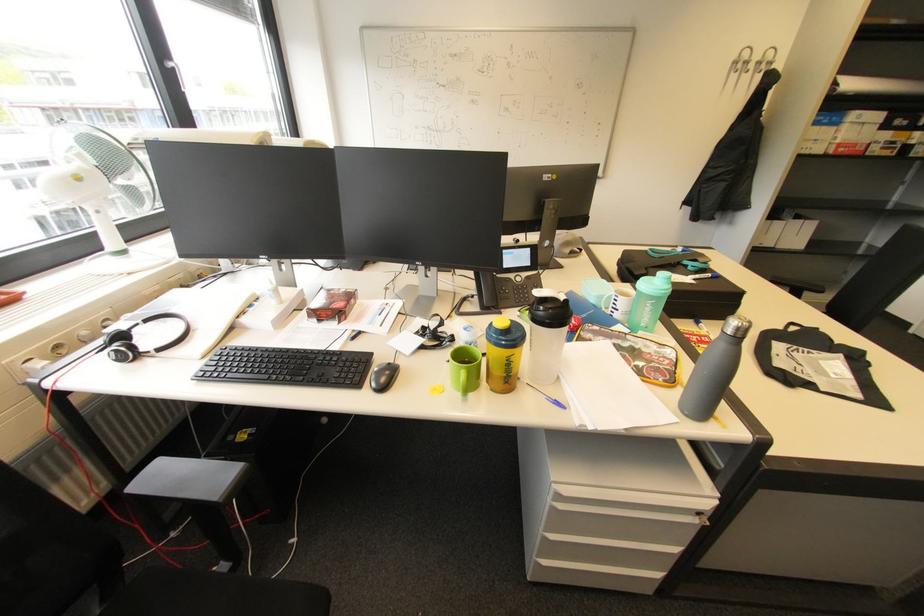
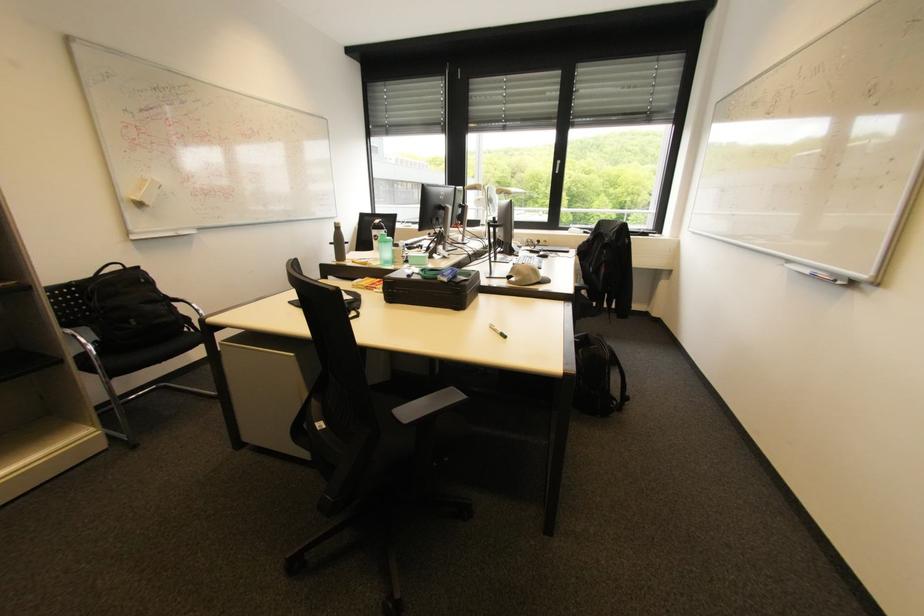
Find the pixel in the second image that matches [739,334] in the first image.

(342, 228)